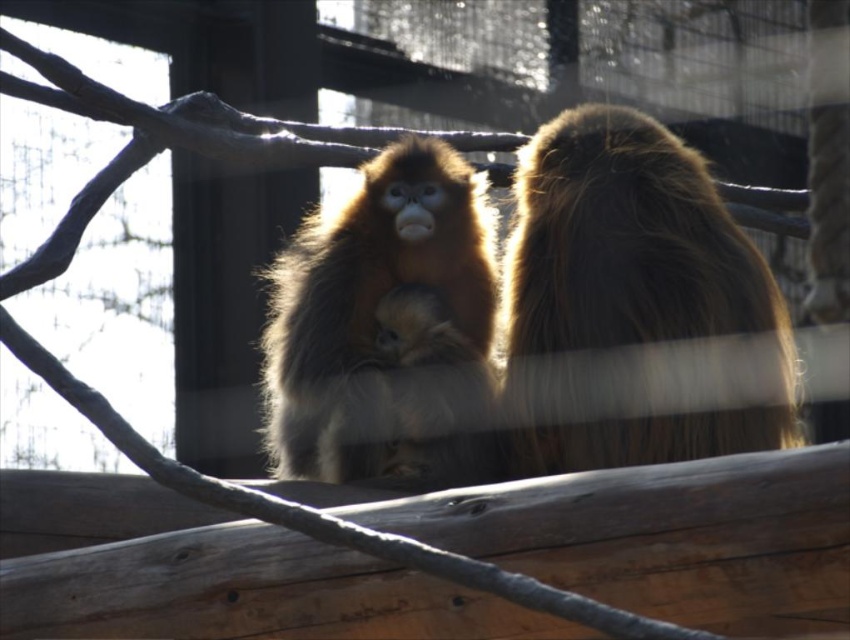
You are a zookeeper trying to locate two specific points in the enclosure for maintenance. The first point is at coordinates point (544, 212) and the second is at point (426, 298). From the perspective of someone standing at the front of the enclosure, which point is closer to the entrance?

Point (544, 212) is in front of point (426, 298), so it is closer to the entrance of the enclosure.

You are standing in front of the zoo enclosure where the two golden snub nosed monkeys are. There is a point at coordinate (437, 180) in the image. If you want to throw a piece of fruit to that point, will it land within the enclosure? The enclosure has a wire mesh fence in the background.

The point at coordinate (437, 180) is 6.32 meters away from the viewer. Since the enclosure has a wire mesh fence in the background, it is likely that the point is within the enclosure as the fence would form the boundary. Therefore, throwing the fruit to that point should land it inside the enclosure.

You are standing in front of the zoo enclosure and want to take a photo of the fuzzy brown monkey at right. The camera you have can focus on objects up to 5 meters away. Will the monkey be in focus?

The fuzzy brown monkey at right is 5.18 meters away from the viewer, which is beyond the camera focus range of 5 meters. The monkey will not be in focus.